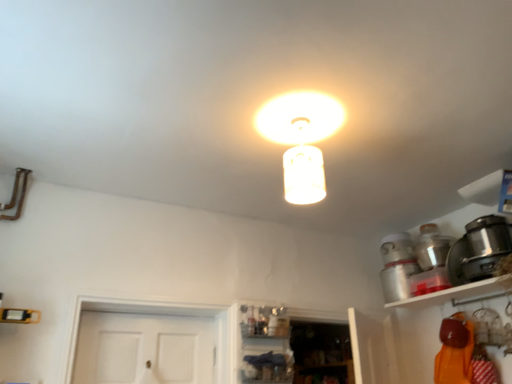
Question: From the image's perspective, would you say matte glass lampshade at center is shown under satin black pot at right, marked as the 2th appliance in a back-to-front arrangement?

Choices:
 (A) yes
 (B) no

Answer: (B)

Question: Does matte glass lampshade at center lie in front of satin black pot at right, marked as the 2th appliance in a back-to-front arrangement?

Choices:
 (A) yes
 (B) no

Answer: (A)

Question: Considering the relative sizes of matte glass lampshade at center and satin black pot at right, which is counted as the 1th appliance, starting from the front, in the image provided, is matte glass lampshade at center thinner than satin black pot at right, which is counted as the 1th appliance, starting from the front,?

Choices:
 (A) no
 (B) yes

Answer: (B)

Question: Are matte glass lampshade at center and satin black pot at right, marked as the 2th appliance in a back-to-front arrangement, far apart?

Choices:
 (A) yes
 (B) no

Answer: (A)

Question: From a real-world perspective, is matte glass lampshade at center on top of satin black pot at right, which is counted as the 1th appliance, starting from the front?

Choices:
 (A) no
 (B) yes

Answer: (B)

Question: In the image, is matte glass lampshade at center positioned in front of or behind metallic silver pot at upper right, the second appliance in the front-to-back sequence?

Choices:
 (A) behind
 (B) front

Answer: (B)

Question: Considering the positions of point (290, 187) and point (449, 241), is point (290, 187) closer or farther from the camera than point (449, 241)?

Choices:
 (A) closer
 (B) farther

Answer: (A)

Question: In terms of height, does matte glass lampshade at center look taller or shorter compared to metallic silver pot at upper right, the second appliance in the front-to-back sequence?

Choices:
 (A) short
 (B) tall

Answer: (B)

Question: From the image's perspective, is matte glass lampshade at center located above or below metallic silver pot at upper right, the second appliance in the front-to-back sequence?

Choices:
 (A) below
 (B) above

Answer: (B)

Question: Is point (426, 248) positioned closer to the camera than point (313, 200)?

Choices:
 (A) farther
 (B) closer

Answer: (A)

Question: Looking at their shapes, would you say metallic silver pot at upper right, the second appliance in the front-to-back sequence, is wider or thinner than matte glass lampshade at center?

Choices:
 (A) wide
 (B) thin

Answer: (A)

Question: Would you say metallic silver pot at upper right, the second appliance in the front-to-back sequence, is inside or outside matte glass lampshade at center?

Choices:
 (A) inside
 (B) outside

Answer: (B)

Question: Based on their sizes in the image, would you say metallic silver pot at upper right, the second appliance in the front-to-back sequence, is bigger or smaller than matte glass lampshade at center?

Choices:
 (A) big
 (B) small

Answer: (A)

Question: From a real-world perspective, is metallic silver pot at upper right, the second appliance in the front-to-back sequence, physically located above or below white glossy shelf at upper right?

Choices:
 (A) above
 (B) below

Answer: (A)

Question: Is metallic silver pot at upper right, which is the first appliance from back to front, to the left or to the right of white glossy shelf at upper right in the image?

Choices:
 (A) left
 (B) right

Answer: (A)